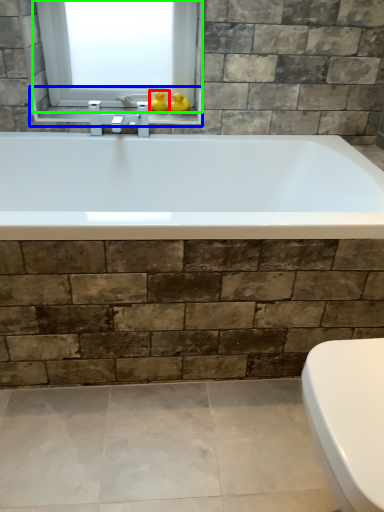
Question: Which is nearer to the duck (highlighted by a red box)? window sill (highlighted by a blue box) or window (highlighted by a green box).

Choices:
 (A) window sill
 (B) window

Answer: (A)